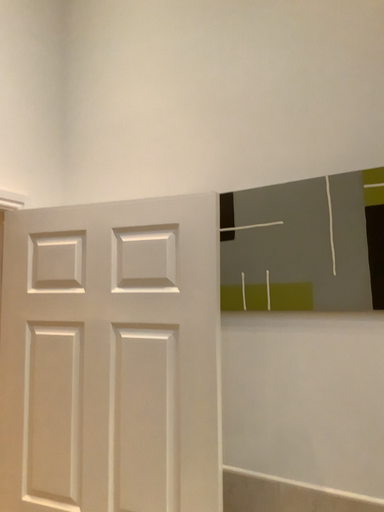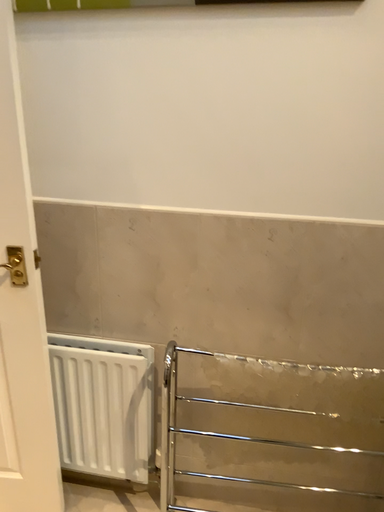
Question: How did the camera likely rotate when shooting the video?

Choices:
 (A) rotated upward
 (B) rotated downward

Answer: (B)